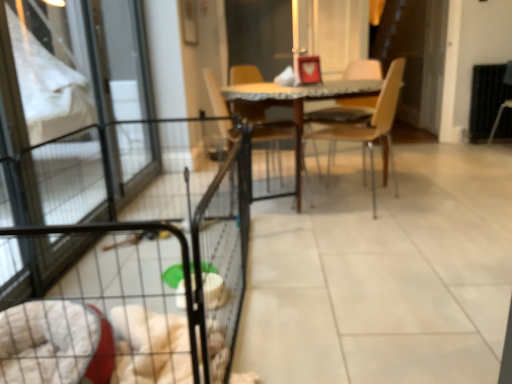
Question: Visually, is clear glass screen door at left positioned to the left or to the right of wooden chair at center, which is counted as the 1th chair, starting from the left?

Choices:
 (A) left
 (B) right

Answer: (A)

Question: Is clear glass screen door at left in front of or behind wooden chair at center, the 2th chair in the right-to-left sequence, in the image?

Choices:
 (A) behind
 (B) front

Answer: (B)

Question: Considering the real-world distances, which object is closest to the wooden chair at center, the first chair from the right?

Choices:
 (A) dark brown leather armchair at right
 (B) wooden table at center
 (C) wooden chair at center, the 2th chair in the right-to-left sequence
 (D) clear glass screen door at left
 (E) black wire cage at lower left

Answer: (B)

Question: Estimate the real-world distances between objects in this image. Which object is closer to the wooden chair at center, which is counted as the 1th chair, starting from the left?

Choices:
 (A) black wire cage at lower left
 (B) dark brown leather armchair at right
 (C) wooden table at center
 (D) clear glass screen door at left
 (E) wooden chair at center, the first chair from the right

Answer: (C)